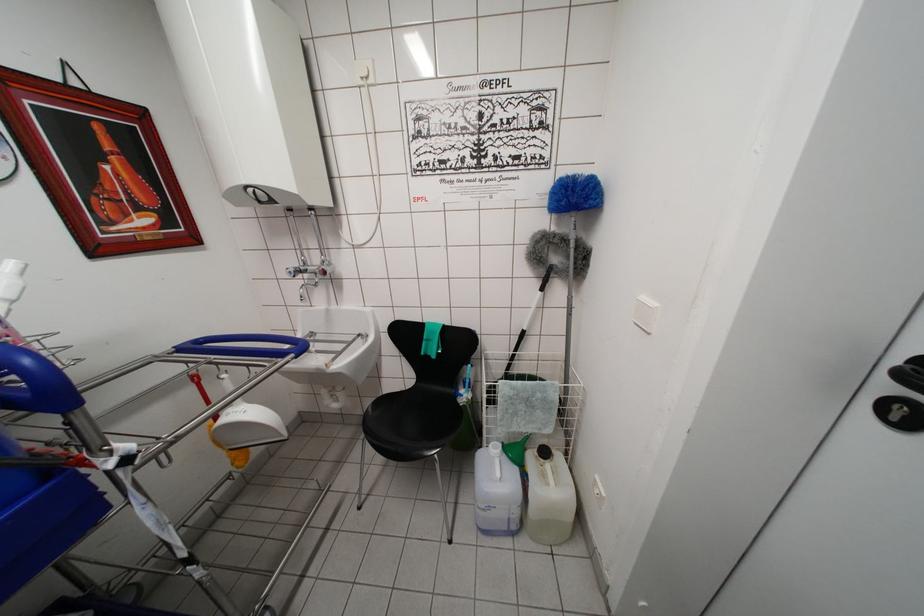
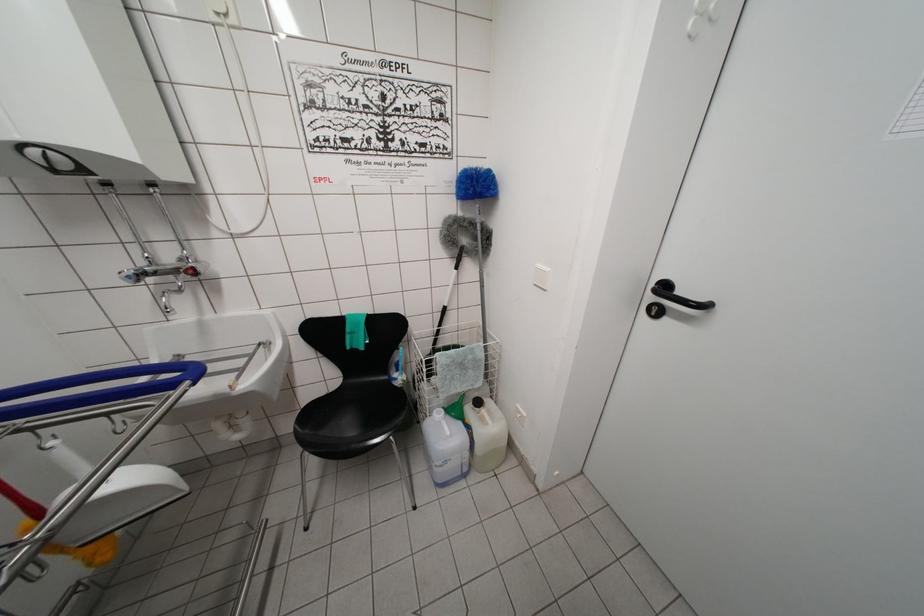
Question: The camera is either moving clockwise (left) or counter-clockwise (right) around the object. The first image is from the beginning of the video and the second image is from the end. Is the camera moving left or right when shooting the video?

Choices:
 (A) Left
 (B) Right

Answer: (A)